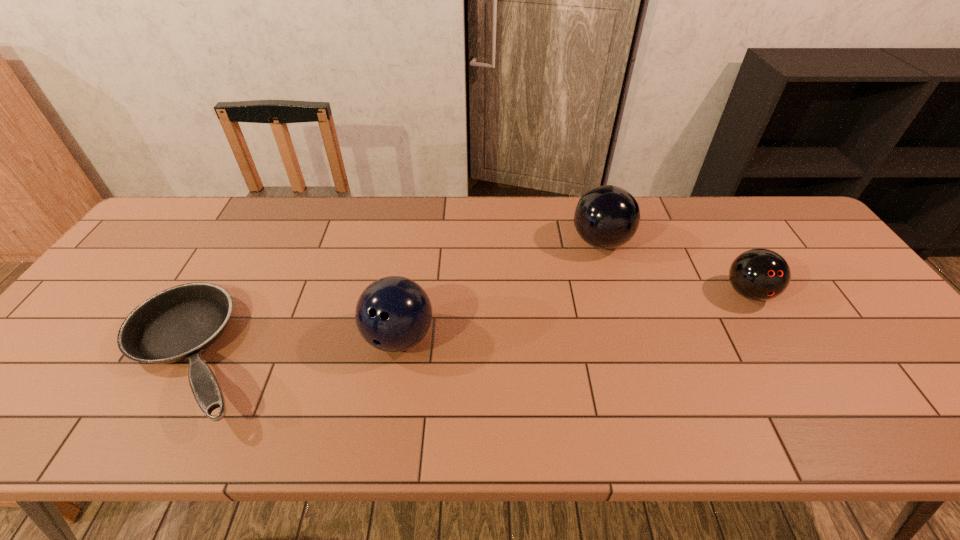
This screenshot has height=540, width=960. I want to click on the second bowling ball from right to left, so click(606, 217).

Image resolution: width=960 pixels, height=540 pixels. I want to click on the farthest object, so click(x=606, y=217).

I want to click on the third object from right to left, so click(394, 313).

You are a GUI agent. You are given a task and a screenshot of the screen. Output one action in this format:
    pyautogui.click(x=<x>, y=<y>)
    Task: Click on the rightmost object
    Image resolution: width=960 pixels, height=540 pixels.
    Given the screenshot: What is the action you would take?
    pyautogui.click(x=759, y=274)

What are the coordinates of `the shortest bowling ball` in the screenshot? It's located at (759, 274).

What are the coordinates of `the shortest object` in the screenshot? It's located at (179, 323).

Locate an element on the screen. the leftmost object is located at coordinates (x=179, y=323).

Identify the location of vacant area located 0.280m on the side of the third object from left to right with the finger holes. (477, 242).

In order to click on free spot located on the side of the third object from left to right with the finger holes in this screenshot , I will do 543,242.

This screenshot has height=540, width=960. Identify the location of free space located on the side of the third object from left to right with the finger holes. (474, 242).